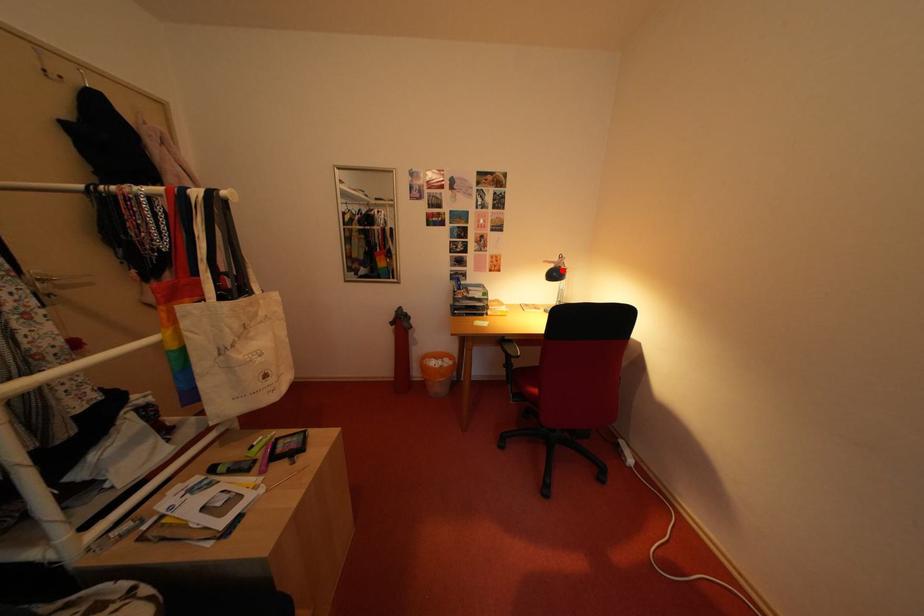
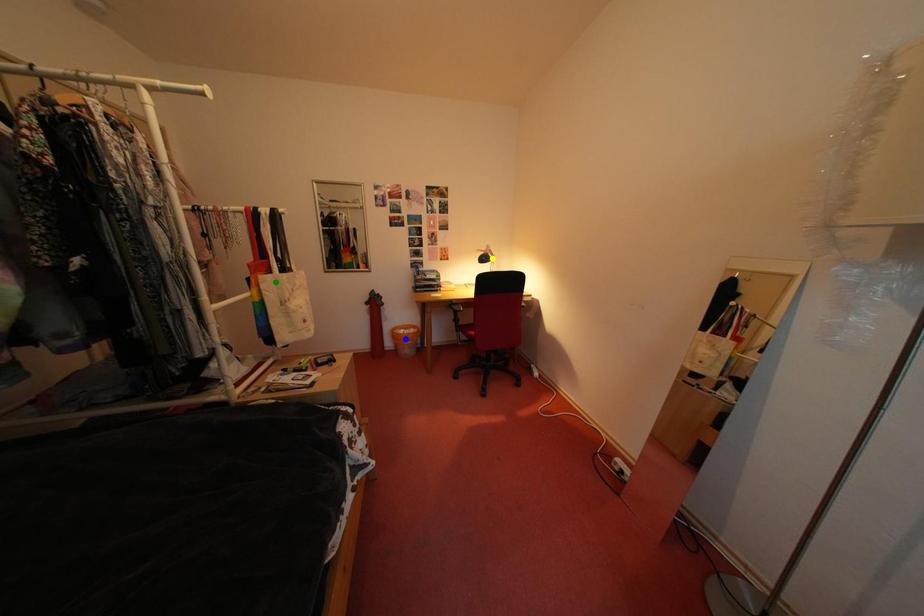
Question: I am providing you with two images of the same scene from different viewpoints. A red point is marked on the first image. You are given multiple points on the second image. Which point in image 2 represents the same 3d spot as the red point in image 1?

Choices:
 (A) blue point
 (B) yellow point
 (C) green point

Answer: (B)